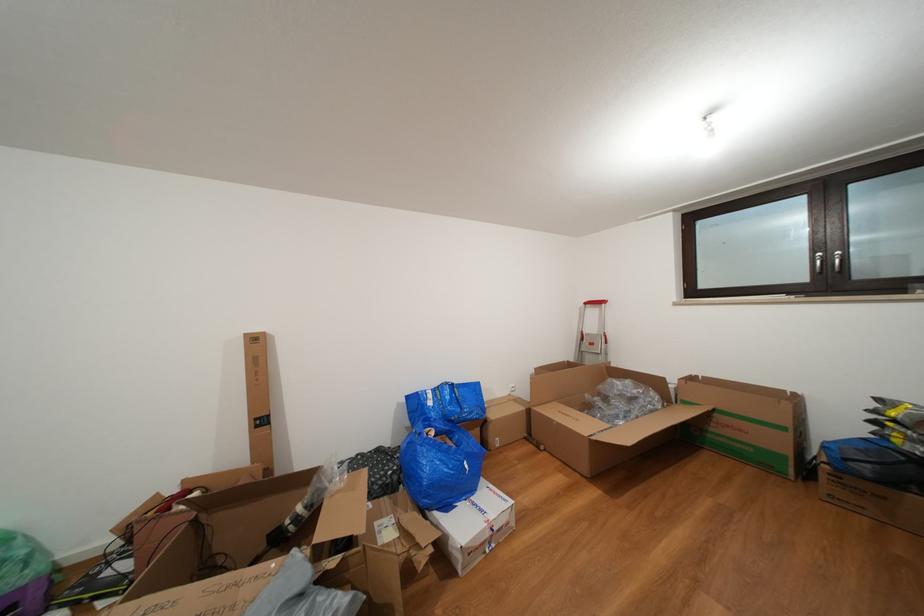
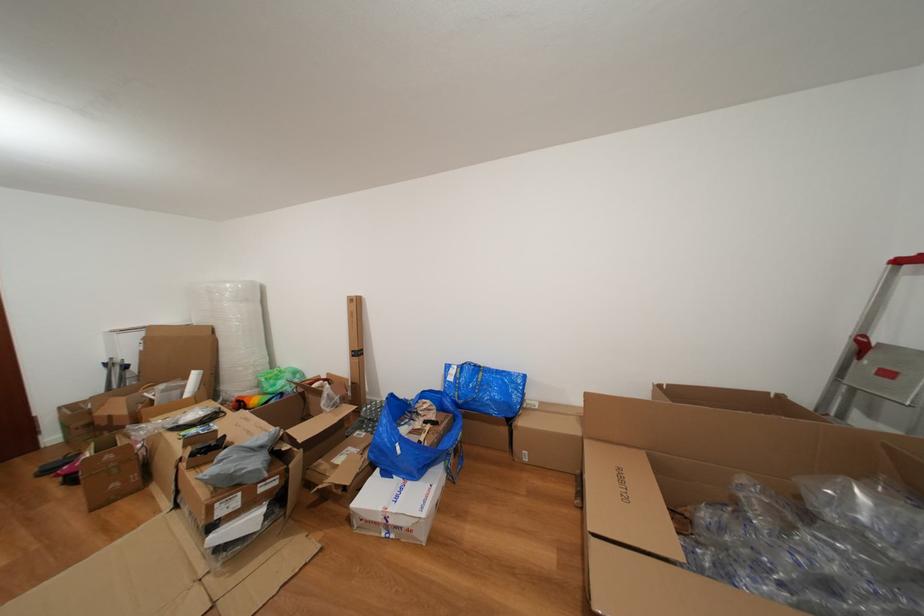
Locate, in the second image, the point that corresponds to the point at 594,400 in the first image.

(750, 485)